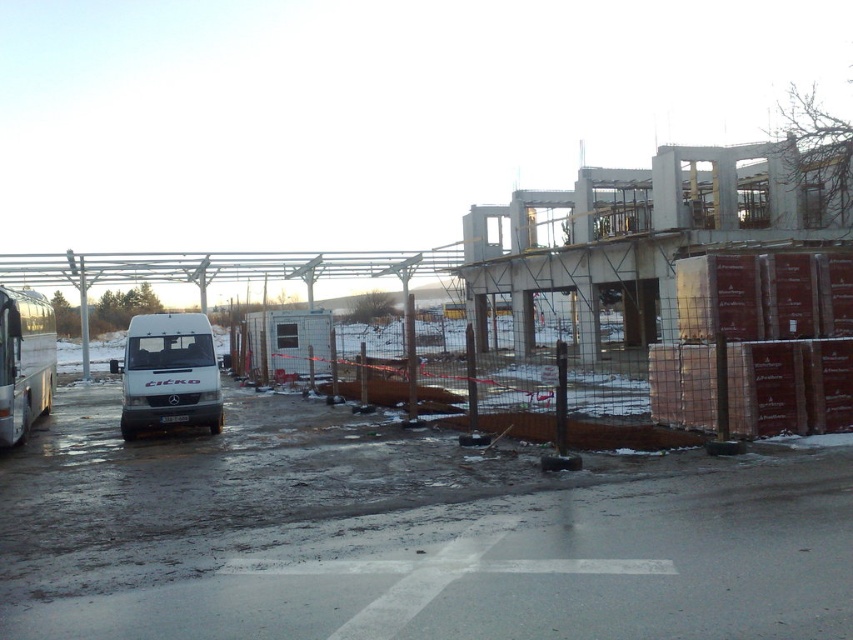
You are a delivery driver who needs to back out of the parking spot between the white matte van at left and the silver metallic bus at left. Based on their positions, which vehicle should you avoid hitting as you back out?

The white matte van at left is below the silver metallic bus at left, so when backing out, you should avoid hitting the white matte van at left which is closer to the ground and positioned lower, while the silver metallic bus at left is higher up and less likely to be in the direct path.

You are a pedestrian standing on the road and want to cross to the other side. The white matte van at left and the silver metallic bus at left are blocking your path. Which vehicle should you move around first to reach the other side safely?

You should move around the white matte van at left first because it is closer to you than the silver metallic bus at left, which is further away.